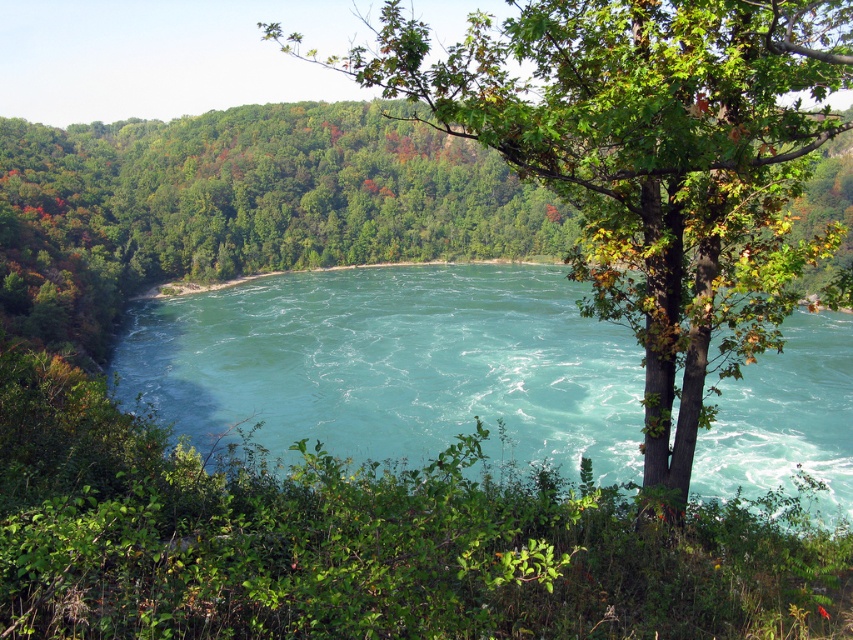
Question: Which of the following is the farthest from the observer?

Choices:
 (A) turquoise water at center
 (B) green leafy tree at center

Answer: (A)

Question: Can you confirm if green leafy tree at center is positioned to the right of turquoise water at center?

Choices:
 (A) yes
 (B) no

Answer: (A)

Question: Is green leafy tree at center behind turquoise water at center?

Choices:
 (A) no
 (B) yes

Answer: (A)

Question: Which point is farther from the camera taking this photo?

Choices:
 (A) (718, 282)
 (B) (309, 284)

Answer: (B)

Question: Observing the image, what is the correct spatial positioning of green leafy tree at center in reference to turquoise water at center?

Choices:
 (A) right
 (B) left

Answer: (A)

Question: Among these objects, which one is nearest to the camera?

Choices:
 (A) turquoise water at center
 (B) green leafy tree at center

Answer: (B)